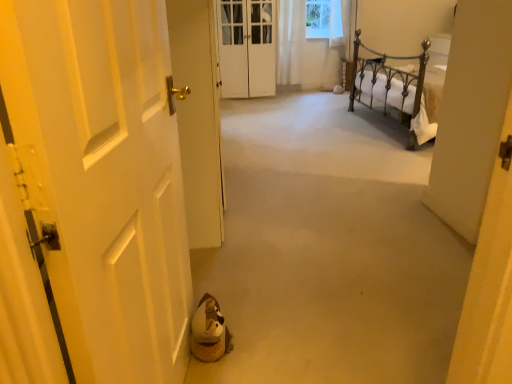
Question: Is white glossy door at left, positioned as the second door in back-to-front order, not inside white matte door at left, which appears as the 3th door when viewed from the back?

Choices:
 (A) no
 (B) yes

Answer: (B)

Question: Considering the relative sizes of white glossy door at left, positioned as the second door in back-to-front order, and white matte door at left, which appears as the 3th door when viewed from the back, in the image provided, is white glossy door at left, positioned as the second door in back-to-front order, thinner than white matte door at left, which appears as the 3th door when viewed from the back,?

Choices:
 (A) no
 (B) yes

Answer: (A)

Question: Does white glossy door at left, positioned as the second door in back-to-front order, have a smaller size compared to white matte door at left, which ranks as the first door in front-to-back order?

Choices:
 (A) yes
 (B) no

Answer: (B)

Question: Is white glossy door at left, positioned as the second door in back-to-front order, far from white matte door at left, which ranks as the first door in front-to-back order?

Choices:
 (A) no
 (B) yes

Answer: (A)

Question: Can you confirm if white glossy door at left, the second door in the front-to-back sequence, is shorter than white matte door at left, which ranks as the first door in front-to-back order?

Choices:
 (A) yes
 (B) no

Answer: (B)

Question: Is white sheer curtain at upper center in front of or behind white matte door at left, which appears as the 3th door when viewed from the back, in the image?

Choices:
 (A) behind
 (B) front

Answer: (A)

Question: Based on their sizes in the image, would you say white sheer curtain at upper center is bigger or smaller than white matte door at left, which appears as the 3th door when viewed from the back?

Choices:
 (A) big
 (B) small

Answer: (B)

Question: Is white sheer curtain at upper center wider or thinner than white matte door at left, which ranks as the first door in front-to-back order?

Choices:
 (A) wide
 (B) thin

Answer: (A)

Question: Is white sheer curtain at upper center to the left or to the right of white matte door at left, which appears as the 3th door when viewed from the back, in the image?

Choices:
 (A) right
 (B) left

Answer: (A)

Question: Is point (433, 329) positioned closer to the camera than point (226, 59)?

Choices:
 (A) closer
 (B) farther

Answer: (A)

Question: Considering the positions of beige carpet at center and white wooden door at center, the 3th door positioned from the front, in the image, is beige carpet at center wider or thinner than white wooden door at center, the 3th door positioned from the front,?

Choices:
 (A) thin
 (B) wide

Answer: (B)

Question: From a real-world perspective, is beige carpet at center above or below white wooden door at center, acting as the first door starting from the back?

Choices:
 (A) below
 (B) above

Answer: (A)

Question: From the image's perspective, is beige carpet at center located above or below white wooden door at center, acting as the first door starting from the back?

Choices:
 (A) above
 (B) below

Answer: (B)

Question: Does point (56, 208) appear closer or farther from the camera than point (293, 72)?

Choices:
 (A) farther
 (B) closer

Answer: (B)

Question: Considering the relative positions of white matte door at left, which ranks as the first door in front-to-back order, and white sheer curtain at upper center in the image provided, is white matte door at left, which ranks as the first door in front-to-back order, to the left or to the right of white sheer curtain at upper center?

Choices:
 (A) right
 (B) left

Answer: (B)